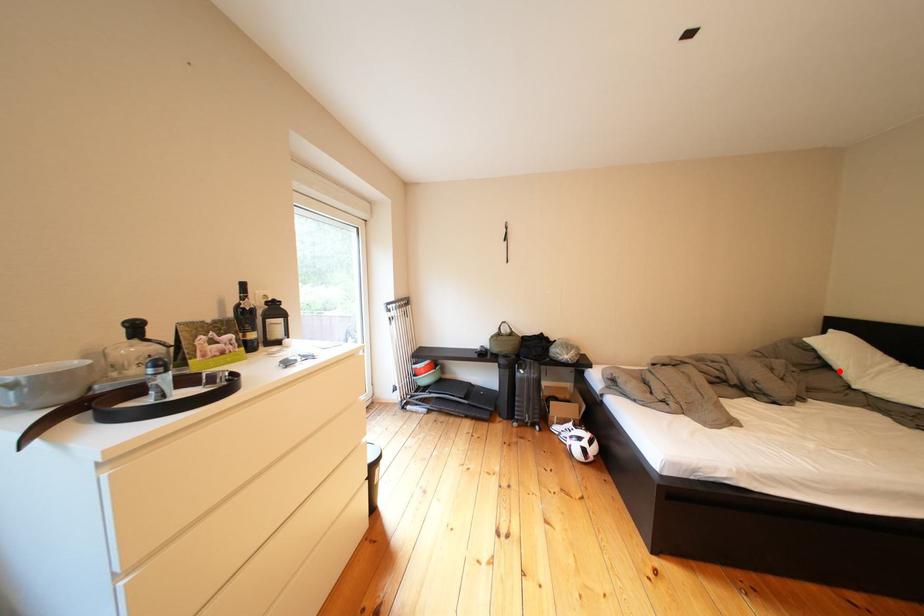
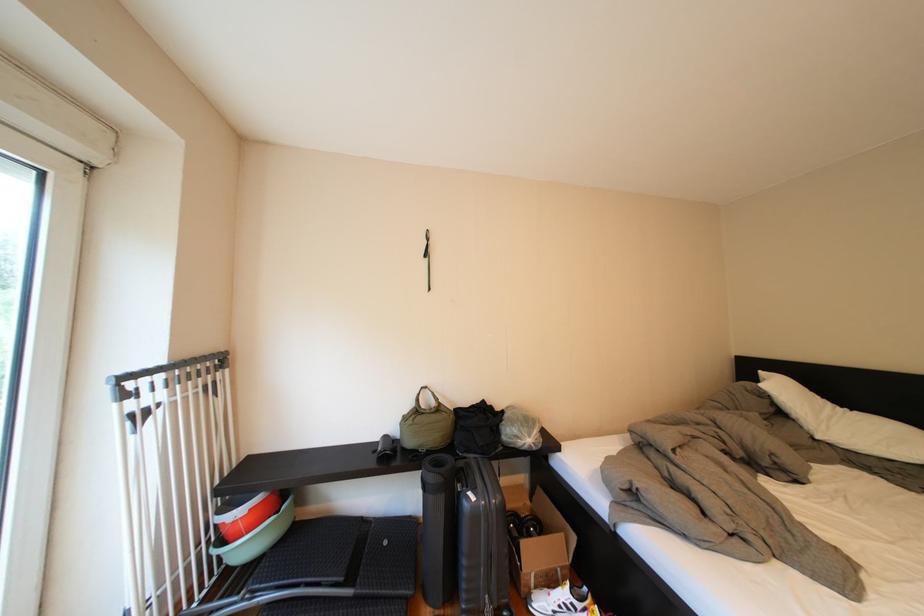
The point at the highlighted location is marked in the first image. Where is the corresponding point in the second image?

(795, 419)